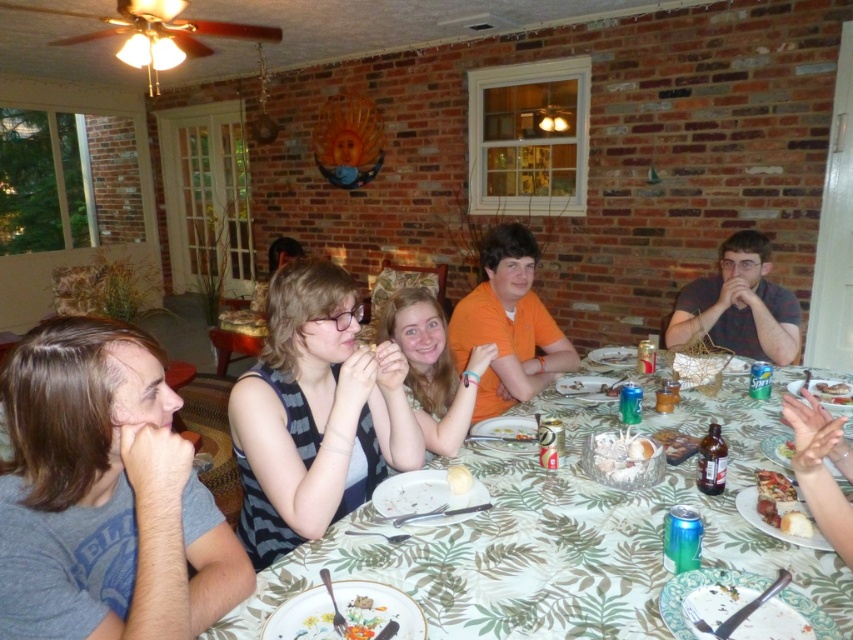
Question: Is striped fabric shirt at center smaller than striped shirt at right?

Choices:
 (A) yes
 (B) no

Answer: (A)

Question: Observing the image, what is the correct spatial positioning of striped fabric shirt at center in reference to crumbly brown pie at lower right?

Choices:
 (A) left
 (B) right

Answer: (A)

Question: Does gray cotton shirt at left appear on the right side of smooth orange shirt at center?

Choices:
 (A) yes
 (B) no

Answer: (B)

Question: Which point appears closest to the camera in this image?

Choices:
 (A) (740, 276)
 (B) (467, 477)

Answer: (B)

Question: Based on their relative distances, which object is nearer to the translucent glass bowl at center?

Choices:
 (A) striped fabric shirt at center
 (B) white crumbly cake at center
 (C) white matte plate at lower right
 (D) striped shirt at right

Answer: (C)

Question: Based on their relative distances, which object is farther from the green leaf-patterned tablecloth at center?

Choices:
 (A) striped shirt at right
 (B) porcelain plate with floral design at lower center
 (C) white matte plate at lower right
 (D) white fluffy bread at lower right

Answer: (A)